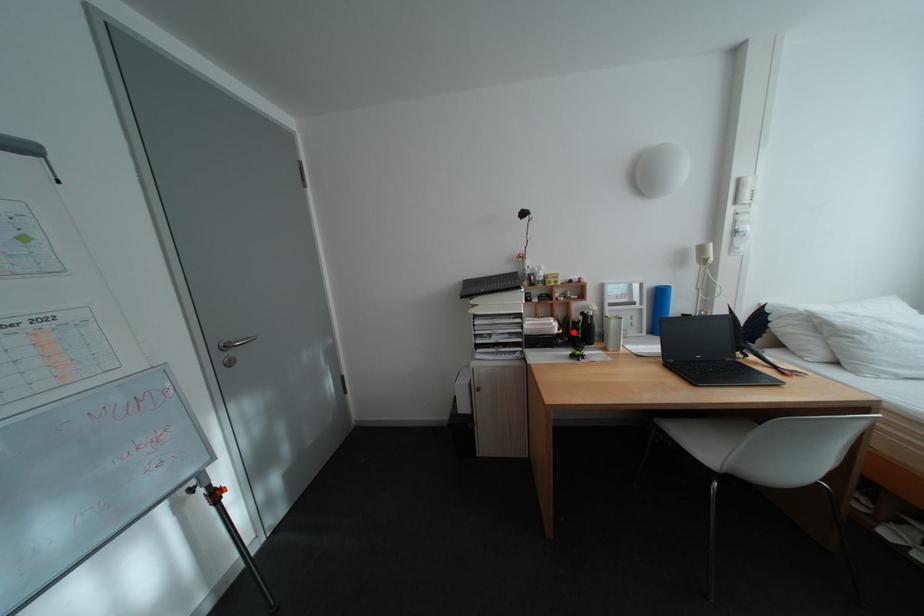
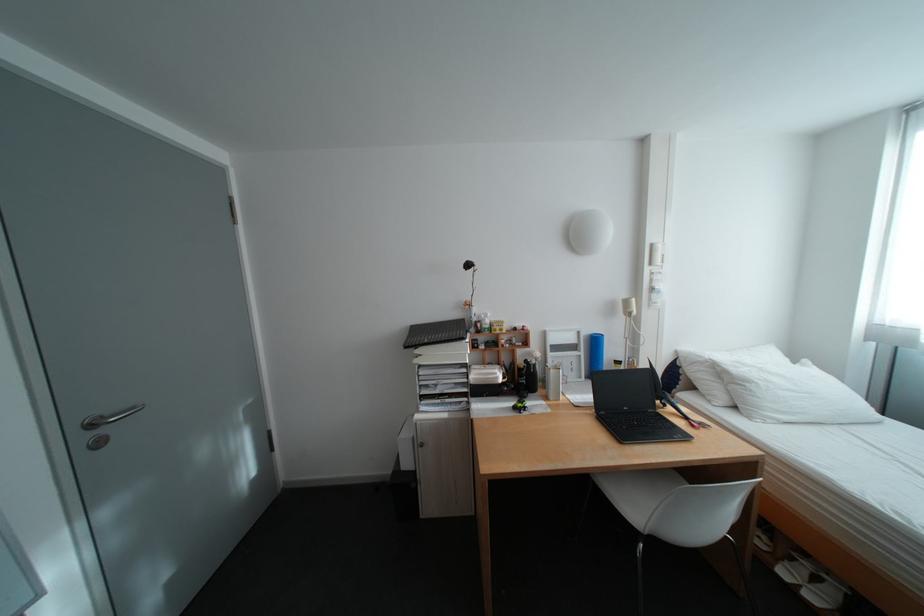
Find the pixel in the second image that matches the highlighted location in the first image.

(518, 381)